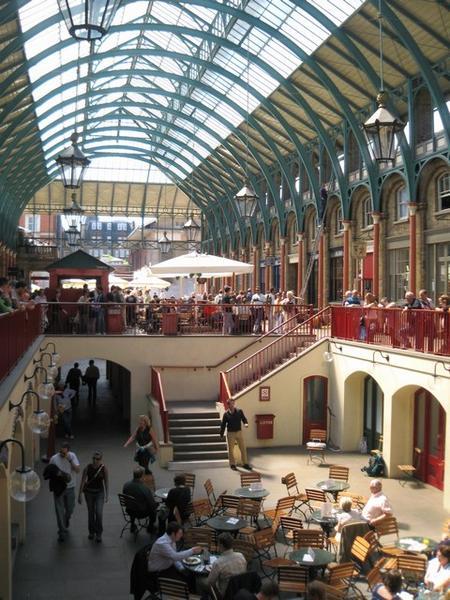
Identify the location of tables. This screenshot has width=450, height=600. (253, 495), (166, 495), (220, 520), (203, 558), (302, 555), (418, 540), (330, 514), (335, 486).